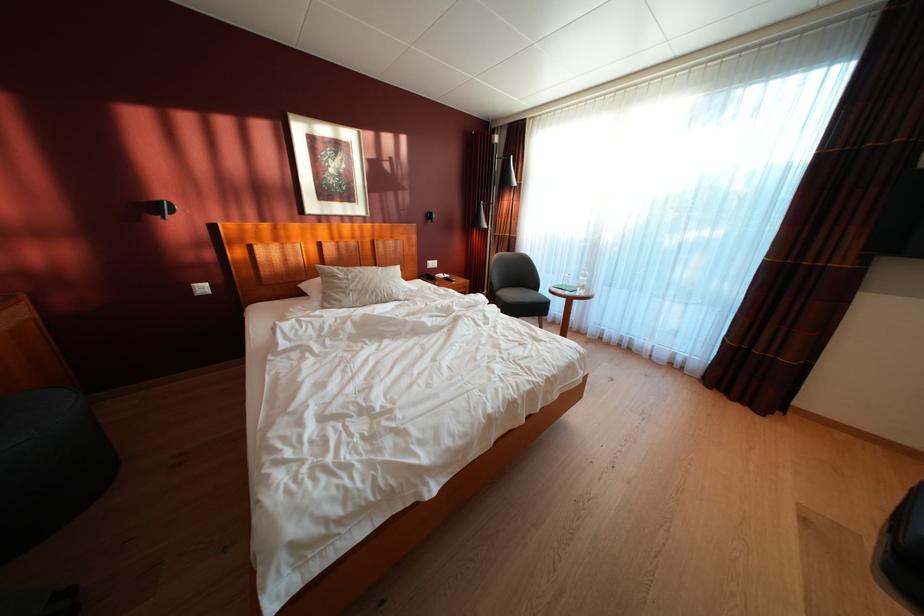
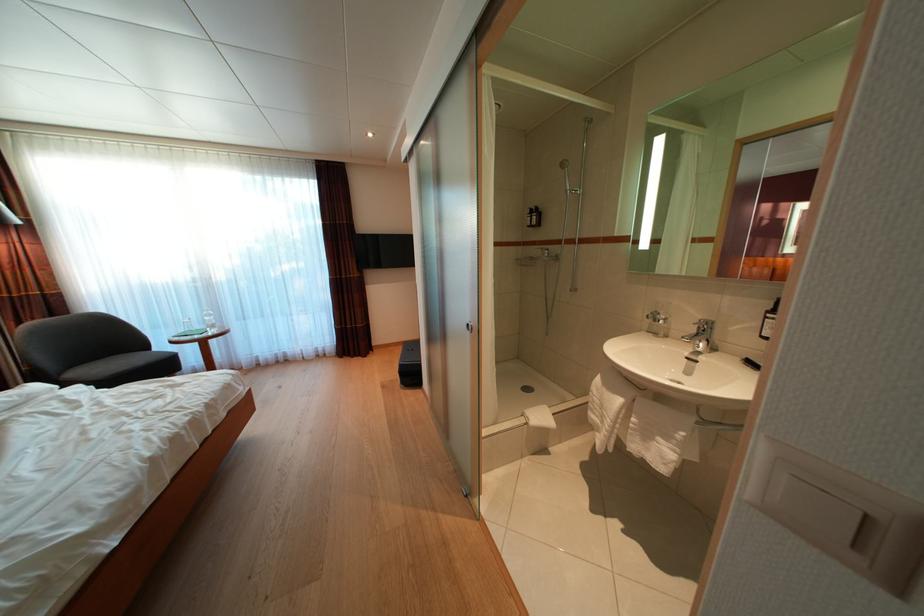
Question: How did the camera likely rotate?

Choices:
 (A) Left
 (B) Right
 (C) Up
 (D) Down

Answer: (B)